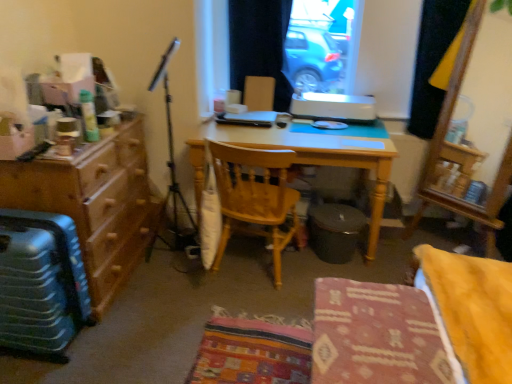
Locate an element on the screen. The image size is (512, 384). vacant region to the right of brown wood dresser at left is located at coordinates (x=183, y=304).